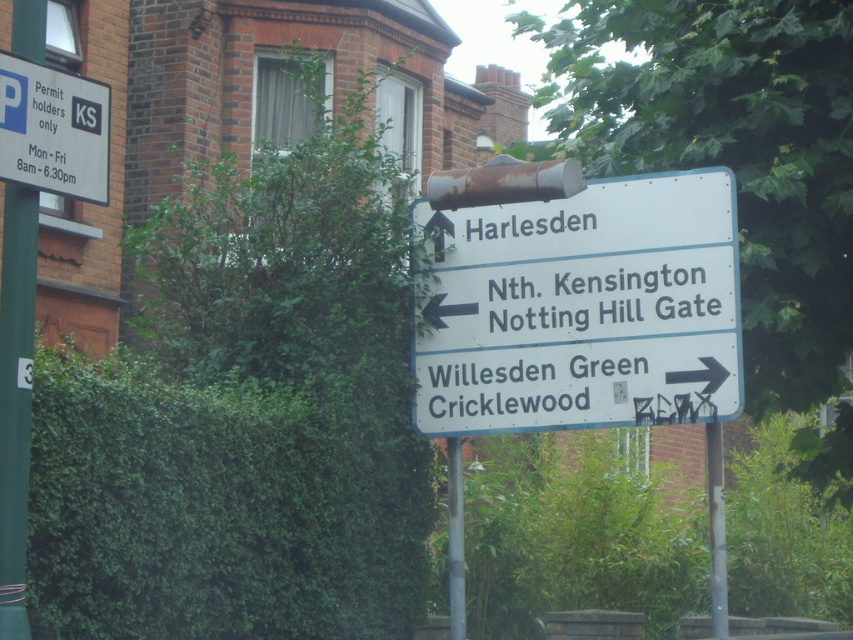
Does point (457, 273) come in front of point (27, 189)?

That is False.

Who is positioned more to the left, white plastic sign at upper center or green painted metal pole at left?

From the viewer's perspective, green painted metal pole at left appears more on the left side.

Find the location of a particular element. This screenshot has width=853, height=640. white plastic sign at upper center is located at coordinates (581, 308).

Does white plastic sign at upper center appear under white plastic parking sign at upper left?

Yes, white plastic sign at upper center is below white plastic parking sign at upper left.

Does white plastic sign at upper center have a larger size compared to white plastic parking sign at upper left?

Indeed, white plastic sign at upper center has a larger size compared to white plastic parking sign at upper left.

Who is more distant from viewer, (498, 304) or (65, 125)?

The point (498, 304) is behind.

Locate an element on the screen. The height and width of the screenshot is (640, 853). white plastic sign at upper center is located at coordinates (581, 308).

Does green leafy hedge at lower left have a lesser height compared to white plastic parking sign at upper left?

In fact, green leafy hedge at lower left may be taller than white plastic parking sign at upper left.

Based on the photo, who is positioned more to the right, green leafy hedge at lower left or white plastic parking sign at upper left?

Positioned to the right is green leafy hedge at lower left.

Find the location of a particular element. The image size is (853, 640). green leafy hedge at lower left is located at coordinates (218, 512).